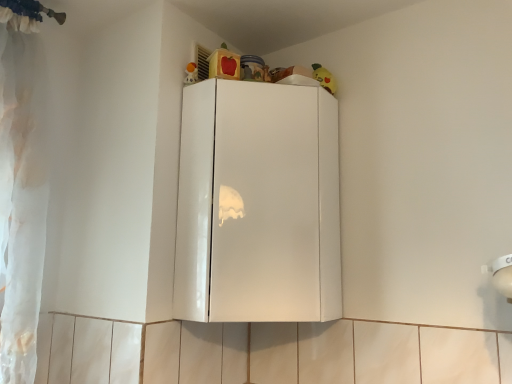
What are the coordinates of `matte plastic toy at upper center, marked as the first toy in a front-to-back arrangement` in the screenshot? It's located at (191, 73).

Find the location of a particular element. yellow plush toy at upper right, which appears as the 2th toy when viewed from the front is located at coordinates (324, 78).

Would you say yellow plush toy at upper right, which appears as the 2th toy when viewed from the front, is to the left or to the right of glossy white cabinet at upper center in the picture?

yellow plush toy at upper right, which appears as the 2th toy when viewed from the front, is to the right of glossy white cabinet at upper center.

What's the angular difference between yellow plush toy at upper right, arranged as the 1th toy when viewed from the right, and glossy white cabinet at upper center's facing directions?

The facing directions of yellow plush toy at upper right, arranged as the 1th toy when viewed from the right, and glossy white cabinet at upper center are 78.1 degrees apart.

Can you confirm if yellow plush toy at upper right, arranged as the 1th toy when viewed from the right, is smaller than glossy white cabinet at upper center?

Indeed, yellow plush toy at upper right, arranged as the 1th toy when viewed from the right, has a smaller size compared to glossy white cabinet at upper center.

Could you tell me if yellow plush toy at upper right, arranged as the 1th toy when viewed from the right, is facing matte plastic toy at upper center, arranged as the 2th toy when viewed from the back?

No, yellow plush toy at upper right, arranged as the 1th toy when viewed from the right, is not oriented towards matte plastic toy at upper center, arranged as the 2th toy when viewed from the back.

Locate an element on the screen. This screenshot has height=384, width=512. toy lying in front of the yellow plush toy at upper right, arranged as the 1th toy when viewed from the right is located at coordinates (191, 73).

Which of these two, yellow plush toy at upper right, which is the 1th toy from back to front, or matte plastic toy at upper center, the 2th toy from the right, is bigger?

yellow plush toy at upper right, which is the 1th toy from back to front.

Are matte plastic toy at upper center, the 2th toy from the right, and yellow plush toy at upper right, arranged as the 2th toy when viewed from the left, located far from each other?

They are positioned close to each other.

Could you tell me if matte plastic toy at upper center, arranged as the first toy when viewed from the left, is turned towards yellow plush toy at upper right, which appears as the 2th toy when viewed from the front?

No.

Considering their positions, is matte plastic toy at upper center, the 2th toy from the right, located in front of or behind yellow plush toy at upper right, which is the 1th toy from back to front?

Visually, matte plastic toy at upper center, the 2th toy from the right, is located in front of yellow plush toy at upper right, which is the 1th toy from back to front.

Which is behind, point (184, 81) or point (328, 81)?

The point (328, 81) is farther.

From a real-world perspective, does glossy white cabinet at upper center stand above matte plastic toy at upper center, arranged as the 2th toy when viewed from the back?

Actually, glossy white cabinet at upper center is physically below matte plastic toy at upper center, arranged as the 2th toy when viewed from the back, in the real world.

Is matte plastic toy at upper center, arranged as the 2th toy when viewed from the back, inside glossy white cabinet at upper center?

No, matte plastic toy at upper center, arranged as the 2th toy when viewed from the back, is not a part of glossy white cabinet at upper center.

Considering the sizes of objects glossy white cabinet at upper center and matte plastic toy at upper center, arranged as the first toy when viewed from the left, in the image provided, who is bigger, glossy white cabinet at upper center or matte plastic toy at upper center, arranged as the first toy when viewed from the left,?

With larger size is glossy white cabinet at upper center.

Is glossy white cabinet at upper center next to matte plastic toy at upper center, arranged as the first toy when viewed from the left?

No, glossy white cabinet at upper center is not with matte plastic toy at upper center, arranged as the first toy when viewed from the left.

Is matte plastic toy at upper center, the 2th toy from the right, positioned behind glossy white cabinet at upper center?

That is True.

Would you say matte plastic toy at upper center, marked as the first toy in a front-to-back arrangement, is outside glossy white cabinet at upper center?

Yes, matte plastic toy at upper center, marked as the first toy in a front-to-back arrangement, is located beyond the bounds of glossy white cabinet at upper center.

Between matte plastic toy at upper center, marked as the first toy in a front-to-back arrangement, and glossy white cabinet at upper center, which one has larger size?

glossy white cabinet at upper center.

In terms of width, does matte plastic toy at upper center, the 2th toy from the right, look wider or thinner when compared to glossy white cabinet at upper center?

In the image, matte plastic toy at upper center, the 2th toy from the right, appears to be more narrow than glossy white cabinet at upper center.

Considering the sizes of objects glossy white cabinet at upper center and yellow plush toy at upper right, which is the 1th toy from back to front, in the image provided, who is thinner, glossy white cabinet at upper center or yellow plush toy at upper right, which is the 1th toy from back to front,?

yellow plush toy at upper right, which is the 1th toy from back to front.

From the image's perspective, which one is positioned higher, glossy white cabinet at upper center or yellow plush toy at upper right, which is the 1th toy from back to front?

yellow plush toy at upper right, which is the 1th toy from back to front.

Can you confirm if glossy white cabinet at upper center is bigger than yellow plush toy at upper right, arranged as the 2th toy when viewed from the left?

Indeed, glossy white cabinet at upper center has a larger size compared to yellow plush toy at upper right, arranged as the 2th toy when viewed from the left.

At what (x,y) coordinates should I click in order to perform the action: click on toy that is the 1st one when counting upward from the glossy white cabinet at upper center (from the image's perspective). Please return your answer as a coordinate pair (x, y). Looking at the image, I should click on (324, 78).

Locate an element on the screen. toy behind the matte plastic toy at upper center, marked as the first toy in a front-to-back arrangement is located at coordinates (324, 78).

Considering their positions, is matte plastic toy at upper center, the 2th toy from the right, positioned closer to glossy white cabinet at upper center than yellow plush toy at upper right, which appears as the 2th toy when viewed from the front?

Based on the image, matte plastic toy at upper center, the 2th toy from the right, appears to be nearer to glossy white cabinet at upper center.

Based on their spatial positions, is glossy white cabinet at upper center or yellow plush toy at upper right, arranged as the 2th toy when viewed from the left, further from matte plastic toy at upper center, arranged as the first toy when viewed from the left?

glossy white cabinet at upper center is further to matte plastic toy at upper center, arranged as the first toy when viewed from the left.

Looking at the image, which one is located closer to yellow plush toy at upper right, arranged as the 1th toy when viewed from the right, matte plastic toy at upper center, arranged as the first toy when viewed from the left, or glossy white cabinet at upper center?

matte plastic toy at upper center, arranged as the first toy when viewed from the left, lies closer to yellow plush toy at upper right, arranged as the 1th toy when viewed from the right, than the other object.

When comparing their distances from glossy white cabinet at upper center, does yellow plush toy at upper right, arranged as the 2th toy when viewed from the left, or matte plastic toy at upper center, arranged as the 2th toy when viewed from the back, seem closer?

matte plastic toy at upper center, arranged as the 2th toy when viewed from the back, is closer to glossy white cabinet at upper center.

From the image, which object appears to be farther from matte plastic toy at upper center, arranged as the first toy when viewed from the left, yellow plush toy at upper right, arranged as the 2th toy when viewed from the left, or glossy white cabinet at upper center?

glossy white cabinet at upper center lies further to matte plastic toy at upper center, arranged as the first toy when viewed from the left, than the other object.

When comparing their distances from yellow plush toy at upper right, arranged as the 2th toy when viewed from the left, does glossy white cabinet at upper center or matte plastic toy at upper center, arranged as the 2th toy when viewed from the back, seem closer?

Among the two, matte plastic toy at upper center, arranged as the 2th toy when viewed from the back, is located nearer to yellow plush toy at upper right, arranged as the 2th toy when viewed from the left.

What are the coordinates of `toy that lies between matte plastic toy at upper center, arranged as the 2th toy when viewed from the back, and glossy white cabinet at upper center from top to bottom` in the screenshot? It's located at (324, 78).